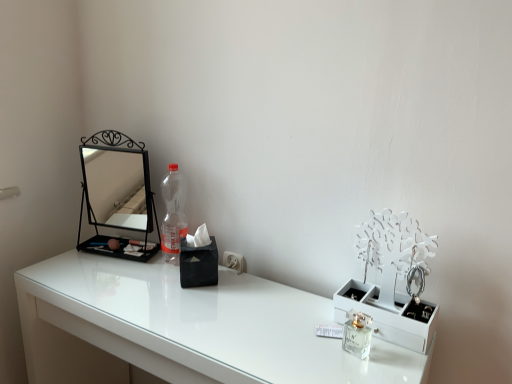
Question: Is white glossy table at center located within clear glass perfume at center?

Choices:
 (A) no
 (B) yes

Answer: (A)

Question: Considering the relative sizes of clear glass perfume at center and white glossy table at center in the image provided, is clear glass perfume at center smaller than white glossy table at center?

Choices:
 (A) yes
 (B) no

Answer: (A)

Question: Is clear glass perfume at center oriented away from white glossy table at center?

Choices:
 (A) yes
 (B) no

Answer: (B)

Question: Considering the relative positions of clear glass perfume at center and white glossy table at center in the image provided, is clear glass perfume at center to the left of white glossy table at center from the viewer's perspective?

Choices:
 (A) no
 (B) yes

Answer: (A)

Question: Considering the relative sizes of clear glass perfume at center and white glossy table at center in the image provided, is clear glass perfume at center bigger than white glossy table at center?

Choices:
 (A) no
 (B) yes

Answer: (A)

Question: Considering their positions, is black metal mirror at left located in front of or behind white glossy table at center?

Choices:
 (A) behind
 (B) front

Answer: (A)

Question: Would you say black metal mirror at left is to the left or to the right of white glossy table at center in the picture?

Choices:
 (A) left
 (B) right

Answer: (A)

Question: Considering the positions of black metal mirror at left and white glossy table at center in the image, is black metal mirror at left wider or thinner than white glossy table at center?

Choices:
 (A) thin
 (B) wide

Answer: (A)

Question: From a real-world perspective, is black metal mirror at left above or below white glossy table at center?

Choices:
 (A) below
 (B) above

Answer: (B)

Question: From a real-world perspective, is white glossy table at center above or below clear glass perfume at center?

Choices:
 (A) below
 (B) above

Answer: (A)

Question: Looking at their shapes, would you say white glossy table at center is wider or thinner than clear glass perfume at center?

Choices:
 (A) thin
 (B) wide

Answer: (B)

Question: In terms of height, does white glossy table at center look taller or shorter compared to clear glass perfume at center?

Choices:
 (A) tall
 (B) short

Answer: (A)

Question: Considering the positions of point (38, 274) and point (352, 354), is point (38, 274) closer or farther from the camera than point (352, 354)?

Choices:
 (A) closer
 (B) farther

Answer: (B)

Question: From a real-world perspective, relative to white glossy table at center, is clear glass perfume at center vertically above or below?

Choices:
 (A) below
 (B) above

Answer: (B)

Question: Looking at their shapes, would you say clear glass perfume at center is wider or thinner than white glossy table at center?

Choices:
 (A) wide
 (B) thin

Answer: (B)